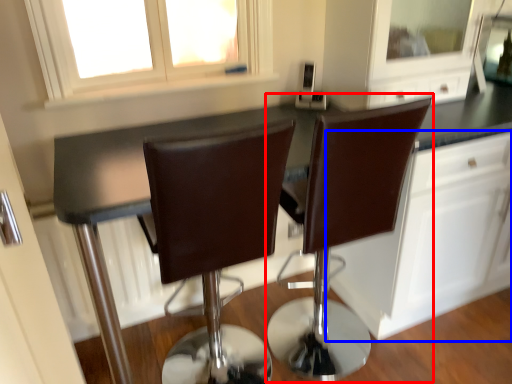
Question: Which object appears farthest to the camera in this image, chair (highlighted by a red box) or cabinetry (highlighted by a blue box)?

Choices:
 (A) chair
 (B) cabinetry

Answer: (B)